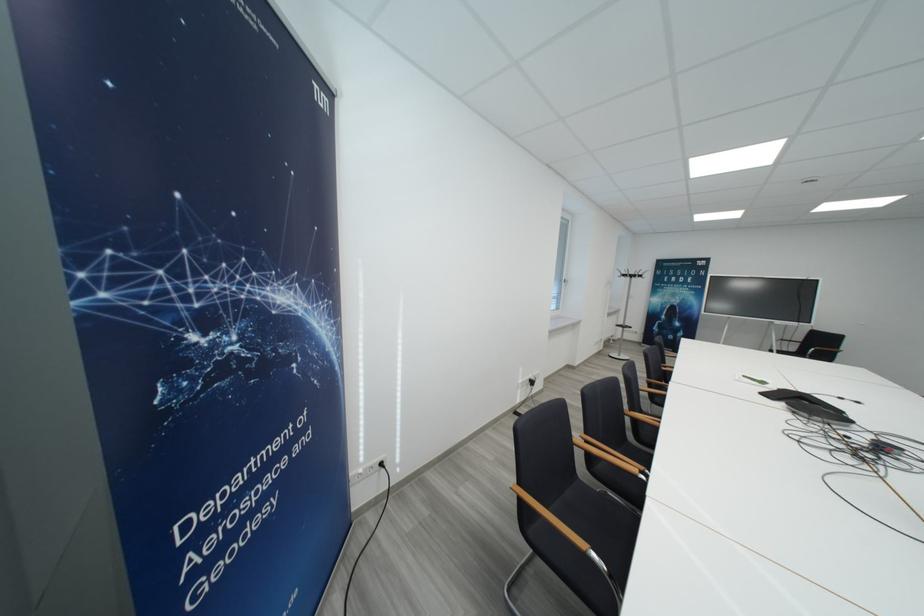
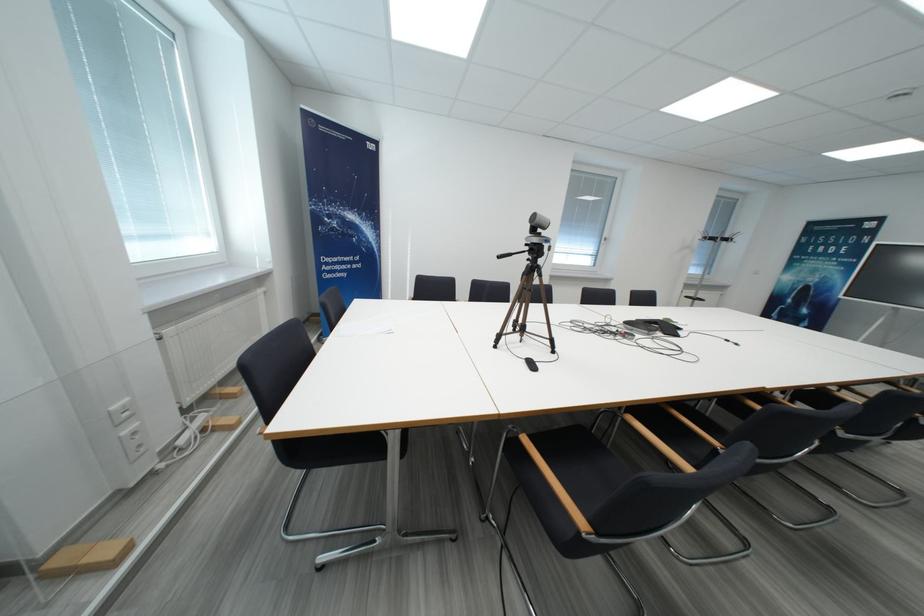
Question: I am providing you with two images of the same scene from different viewpoints. Which of the following objects are not visible in image2?

Choices:
 (A) wooden chair armrest
 (B) black chair sitting surface
 (C) camouflage backpack
 (D) conference phone

Answer: (A)